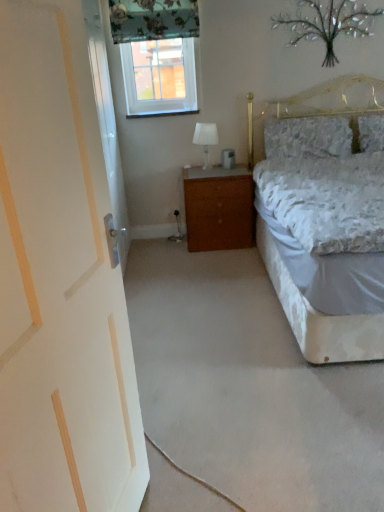
Question: In terms of height, does wooden nightstand at center look taller or shorter compared to metallic silver tree at upper center?

Choices:
 (A) tall
 (B) short

Answer: (A)

Question: Is wooden nightstand at center inside or outside of metallic silver tree at upper center?

Choices:
 (A) outside
 (B) inside

Answer: (A)

Question: Which of these objects is positioned closest to the clear glass window at upper center?

Choices:
 (A) white glossy door at left
 (B) fluffy white pillow at upper right, positioned as the 1th pillow in left-to-right order
 (C) fluffy white pillow at upper right, the first pillow positioned from the right
 (D) floral fabric curtain at upper center
 (E) metallic silver tree at upper center

Answer: (D)

Question: Which object is positioned closest to the white painted wood door at left?

Choices:
 (A) wooden nightstand at center
 (B) fluffy white pillow at upper right, which appears as the second pillow when viewed from the left
 (C) clear glass window at upper center
 (D) floral fabric curtain at upper center
 (E) white glass table lamp at center

Answer: (A)